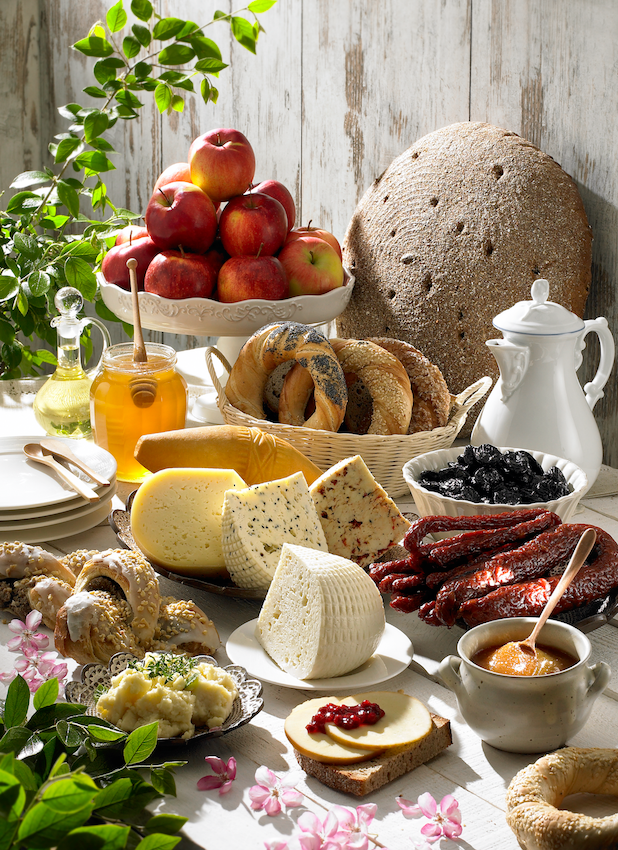
The height and width of the screenshot is (850, 618). Find the location of `milk glass`. milk glass is located at coordinates (541, 298), (539, 399).